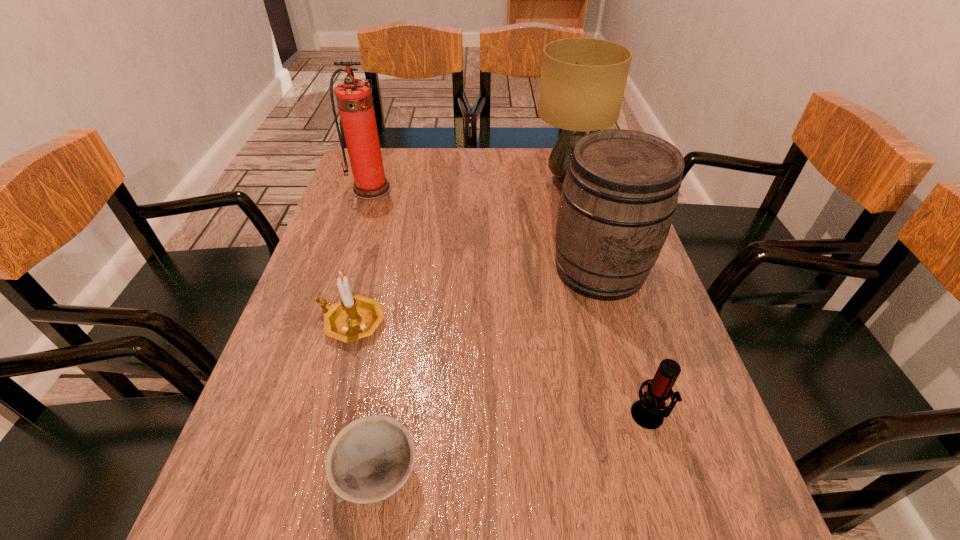
This screenshot has width=960, height=540. Identify the location of free spot located 0.210m on the back of the candle holder. (373, 242).

The width and height of the screenshot is (960, 540). I want to click on free space located 0.100m on the left of the fifth farthest object, so click(577, 415).

Identify the location of vacant point located on the back of the shortest object. This screenshot has height=540, width=960. (401, 326).

This screenshot has width=960, height=540. Identify the location of lampshade present at the far edge. (583, 80).

Image resolution: width=960 pixels, height=540 pixels. I want to click on fire extinguisher located at the far edge, so [x=354, y=99].

Locate an element on the screen. Image resolution: width=960 pixels, height=540 pixels. fire extinguisher at the left edge is located at coordinates (354, 99).

Image resolution: width=960 pixels, height=540 pixels. I want to click on candle holder present at the left edge, so click(355, 317).

Where is `lampshade that is at the right edge`? This screenshot has width=960, height=540. lampshade that is at the right edge is located at coordinates (583, 80).

This screenshot has width=960, height=540. What are the coordinates of `wine bucket located at the right edge` in the screenshot? It's located at (618, 199).

Locate an element on the screen. This screenshot has width=960, height=540. microphone that is at the right edge is located at coordinates 647,412.